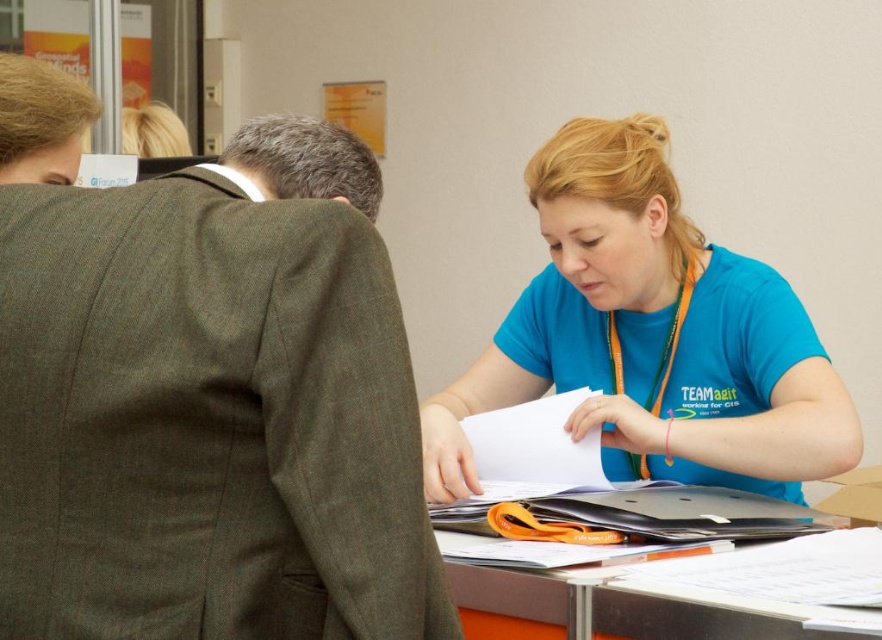
Is blue t-shirt at center further to the viewer compared to metallic gray table at center?

Yes, it is.

From the picture: Is blue t-shirt at center smaller than metallic gray table at center?

No.

What do you see at coordinates (651, 336) in the screenshot? I see `blue t-shirt at center` at bounding box center [651, 336].

At what (x,y) coordinates should I click in order to perform the action: click on blue t-shirt at center. Please return your answer as a coordinate pair (x, y). Looking at the image, I should click on (651, 336).